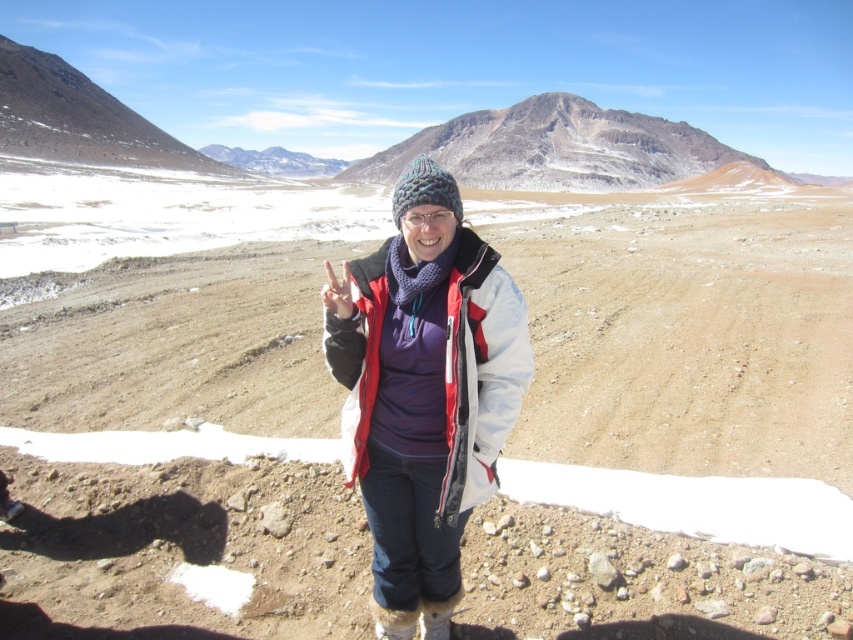
You are a hiker planning to walk from your current position to the point marked at coordinates point (x=317, y=416). Given that you can walk 3 meters per minute, how long will it take you to reach that point?

The distance between point (x=317, y=416) and the viewer is 15.18 meters. At a walking speed of 3 meters per minute, it would take approximately 5.06 minutes to reach the point.

You are a hiker planning to take a photo of the rugged stone mountain at center from the position of the person wearing the matte white jacket at center. Is the mountain directly above you?

The matte white jacket at center is positioned under rugged stone mountain at center, so yes, the mountain is directly above the person wearing the matte white jacket at center.

You are a hiker trying to locate your jacket which is the matte white jacket at center. You see the rugged stone mountain at center in front of you. In which direction should you look to find your jacket?

The matte white jacket at center is to the left of rugged stone mountain at center, so you should look to your left to find your jacket.